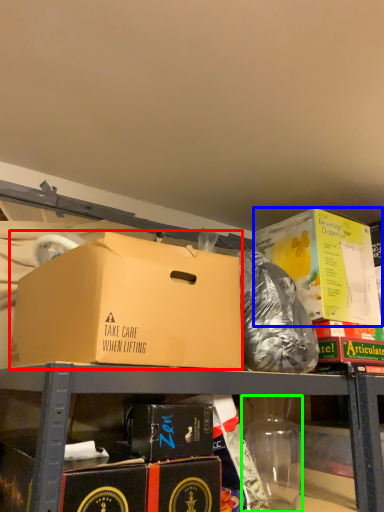
Question: Estimate the real-world distances between objects in this image. Which object is closer to box (highlighted by a red box), box (highlighted by a blue box) or bottle (highlighted by a green box)?

Choices:
 (A) box
 (B) bottle

Answer: (B)